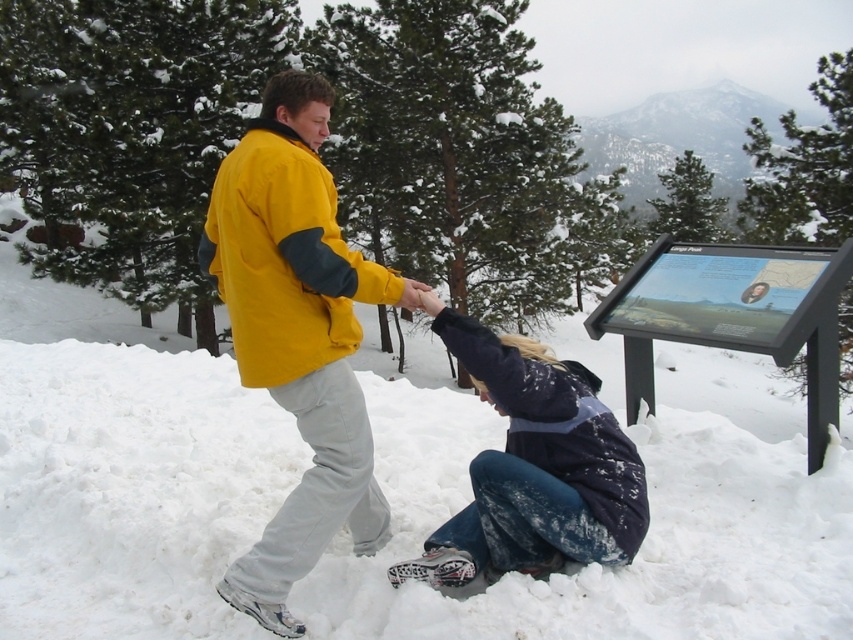
You are planning to build a snowman using the white fluffy snow at lower center and the yellow fleece jacket at upper center. Which object is more suitable for building the snowman?

The white fluffy snow at lower center is more suitable for building the snowman since it is the actual snow, while the yellow fleece jacket at upper center is clothing and cannot be used for this purpose.

You are standing at the edge of the snowy area and want to place a 2.5 meter long wooden board from the white fluffy snow at lower center to where you are standing. Will the board be long enough to reach you?

The distance between the white fluffy snow at lower center and the viewer is 2.42 meters. The board is 2.5 meters long, so it will be long enough to reach you.